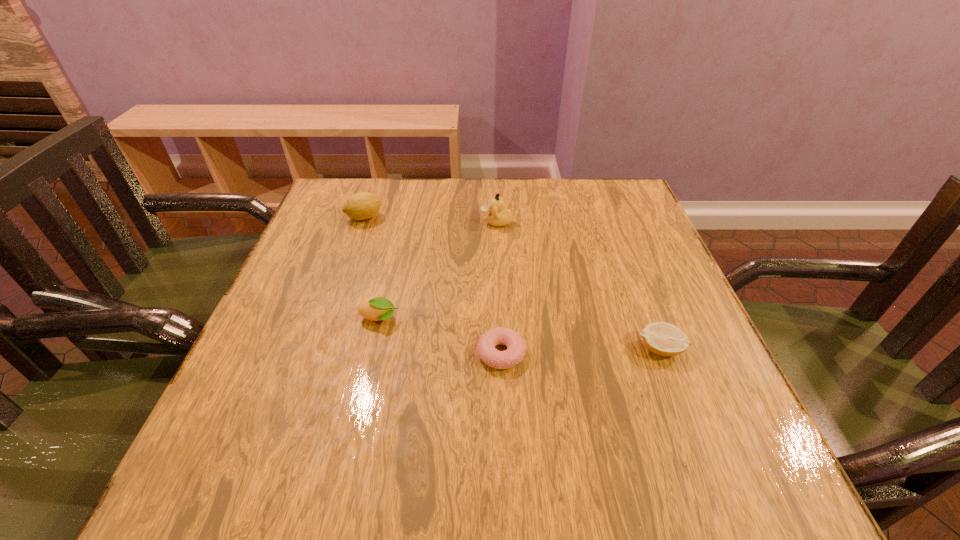
Where is `vacant space at the far edge of the desktop`? The width and height of the screenshot is (960, 540). vacant space at the far edge of the desktop is located at coordinates (550, 179).

Locate an element on the screen. vacant area at the near edge is located at coordinates (596, 498).

Where is `free space at the left edge`? The width and height of the screenshot is (960, 540). free space at the left edge is located at coordinates (300, 346).

In the image, there is a desktop. What are the coordinates of `vacant area at the right edge` in the screenshot? It's located at (645, 274).

Locate an element on the screen. The height and width of the screenshot is (540, 960). vacant position at the far left corner of the desktop is located at coordinates pos(379,187).

The height and width of the screenshot is (540, 960). I want to click on free space at the far right corner of the desktop, so click(x=620, y=179).

I want to click on free space between the fourth tallest object and the doughnut, so click(581, 352).

I want to click on free space between the shortest lemon and the shortest object, so click(x=581, y=352).

Find the location of a particular element. free spot between the tallest object and the rightmost object is located at coordinates (x=579, y=286).

This screenshot has width=960, height=540. What are the coordinates of `free space between the duckling and the rightmost object` in the screenshot? It's located at 579,286.